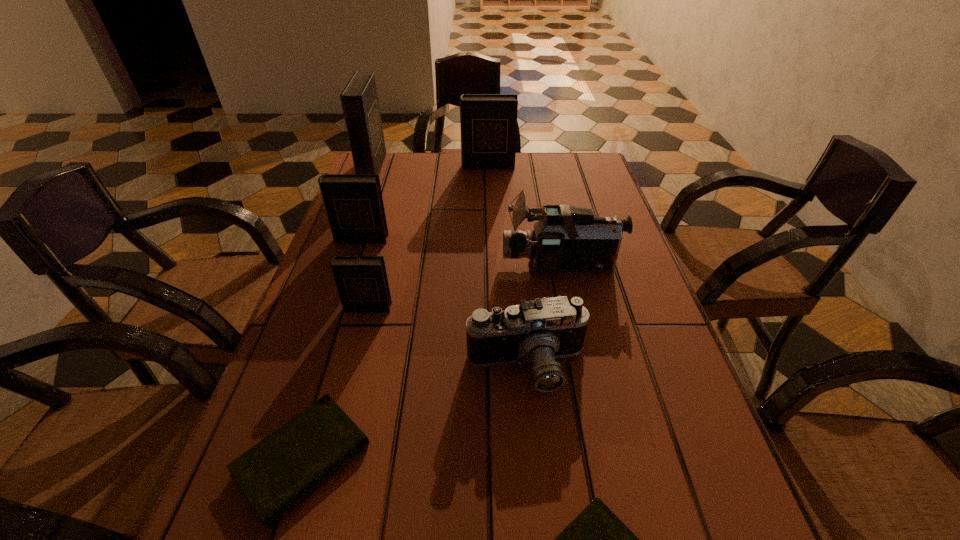
This screenshot has height=540, width=960. What are the coordinates of `free space between the third nearest diary and the fifth nearest object` in the screenshot? It's located at (465, 286).

Locate an element on the screen. The image size is (960, 540). vacant area between the third farthest object and the camera is located at coordinates (444, 303).

Locate an element on the screen. vacant space in between the third nearest diary and the camera is located at coordinates tap(447, 338).

Identify which object is located as the third nearest to the nearest dark diary. Please provide its 2D coordinates. Your answer should be formatted as a tuple, i.e. [(x, y)], where the tuple contains the x and y coordinates of a point satisfying the conditions above.

[(278, 472)]

The image size is (960, 540). What are the coordinates of `object that is the closest one to the second shortest diary` in the screenshot? It's located at (539, 331).

Identify which diary is the second closest to the camera. Please provide its 2D coordinates. Your answer should be formatted as a tuple, i.e. [(x, y)], where the tuple contains the x and y coordinates of a point satisfying the conditions above.

[(596, 539)]

Where is `diary that stands as the closest to the fourth farthest object`? This screenshot has width=960, height=540. diary that stands as the closest to the fourth farthest object is located at coordinates (362, 283).

Identify the location of the fourth closest dark diary to the camera. (488, 122).

This screenshot has width=960, height=540. I want to click on dark diary that is the fourth closest to the camera, so click(488, 122).